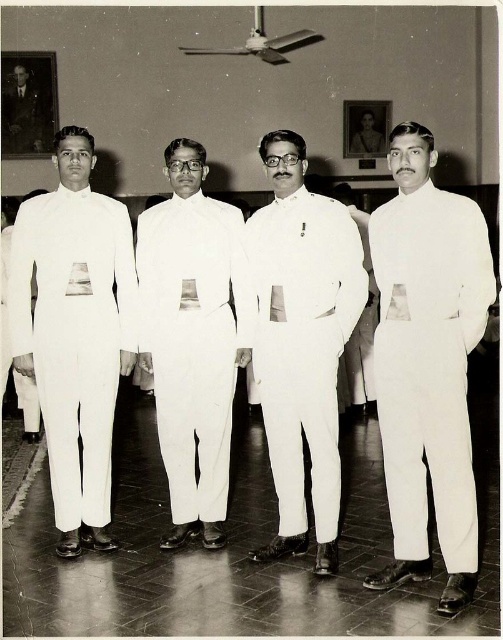
Question: Does white smooth uniform at center come behind smooth black suit at left?

Choices:
 (A) no
 (B) yes

Answer: (A)

Question: Can you confirm if white smooth suit at center is positioned to the left of smooth black suit at left?

Choices:
 (A) no
 (B) yes

Answer: (A)

Question: Which point is farther to the camera?

Choices:
 (A) (353, 396)
 (B) (78, 140)
 (C) (318, 253)
 (D) (214, 221)

Answer: (A)

Question: Among these objects, which one is farthest from the camera?

Choices:
 (A) white smooth suit at right
 (B) white matte suit at center
 (C) white smooth uniform at center

Answer: (B)

Question: Which point appears closest to the camera in this image?

Choices:
 (A) click(x=283, y=472)
 (B) click(x=358, y=221)
 (C) click(x=104, y=333)

Answer: (A)

Question: Can you confirm if white smooth suit at left is positioned below smooth black suit at left?

Choices:
 (A) no
 (B) yes

Answer: (B)